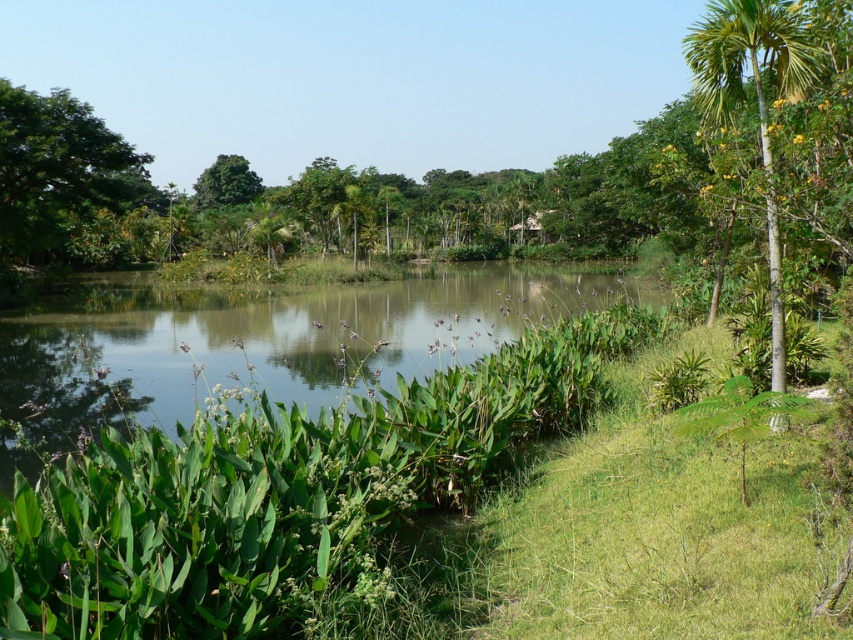
You are standing at the edge of the green leafy river at center and want to look up to see the green leafy tree at upper center. In which direction should you look?

You should look upward because the green leafy river at center is below the green leafy tree at upper center.

Looking at this image, you are standing at the center of the image and want to locate the green leafy tree at upper left. Based on the coordinates provided, in which direction should you look to find it?

The green leafy tree at upper left is located at coordinates point (57, 172), which means you should look towards the upper left direction from your current position at the center of the image.